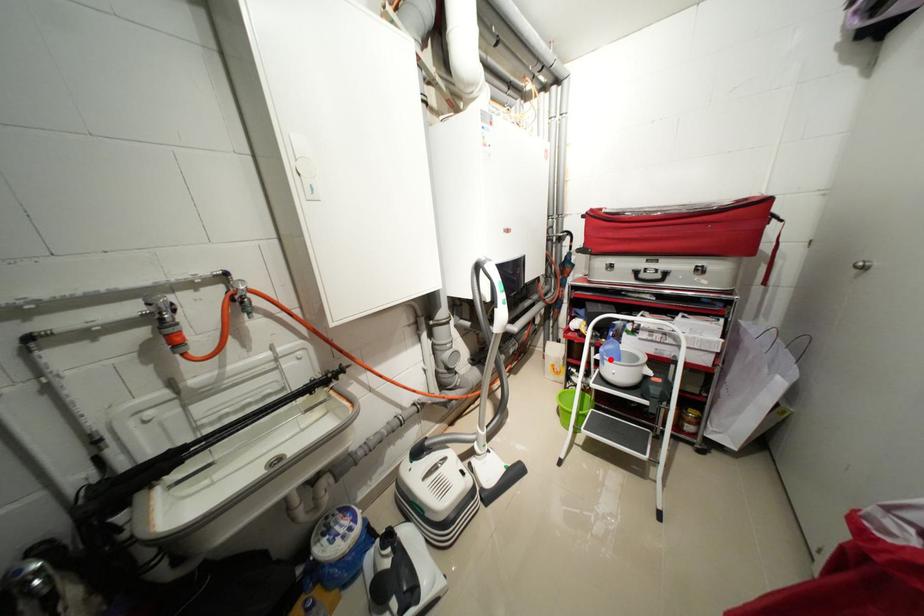
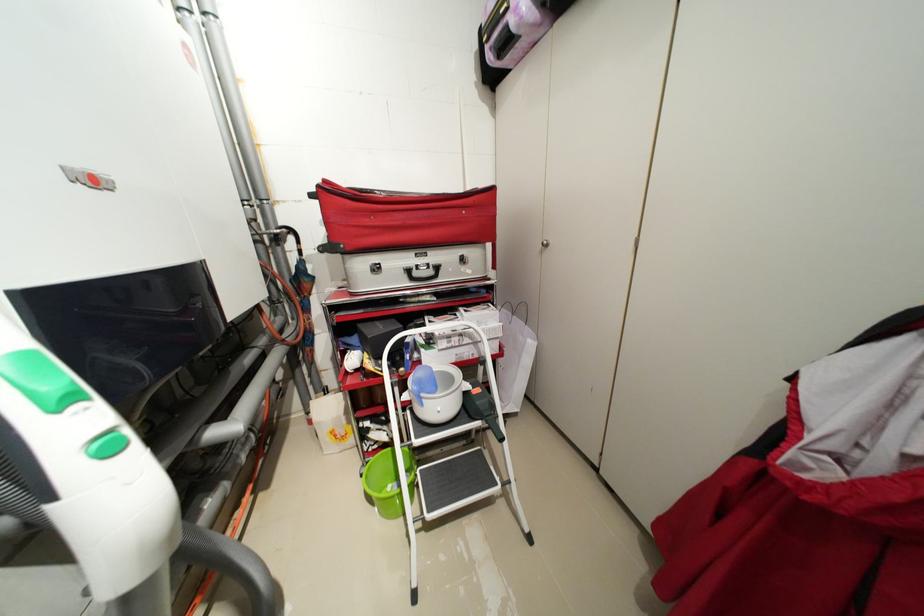
Question: A red point is marked in image1. In image2, is the corresponding 3D point closer to the camera or farther? Reply with the corresponding letter.

Choices:
 (A) The corresponding 3D point is closer.
 (B) The corresponding 3D point is farther.

Answer: (B)